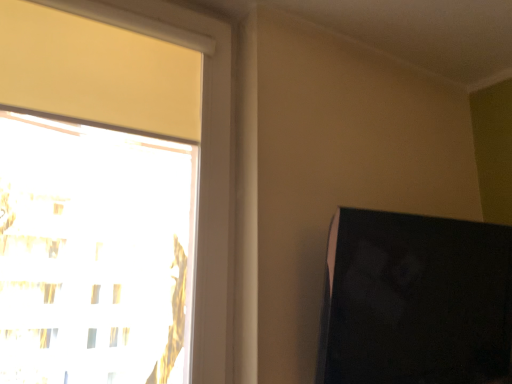
Question: Considering the positions of matte black monitor at right and transparent glass window at upper left in the image, is matte black monitor at right taller or shorter than transparent glass window at upper left?

Choices:
 (A) short
 (B) tall

Answer: (A)

Question: Is point tap(501, 243) positioned closer to the camera than point tap(14, 34)?

Choices:
 (A) farther
 (B) closer

Answer: (A)

Question: Considering the relative positions of matte black monitor at right and transparent glass window at upper left in the image provided, is matte black monitor at right to the left or to the right of transparent glass window at upper left?

Choices:
 (A) left
 (B) right

Answer: (B)

Question: Is transparent glass window at upper left bigger or smaller than matte black monitor at right?

Choices:
 (A) big
 (B) small

Answer: (B)

Question: From their relative heights in the image, would you say transparent glass window at upper left is taller or shorter than matte black monitor at right?

Choices:
 (A) tall
 (B) short

Answer: (A)

Question: Would you say transparent glass window at upper left is to the left or to the right of matte black monitor at right in the picture?

Choices:
 (A) right
 (B) left

Answer: (B)

Question: From the image's perspective, relative to matte black monitor at right, is transparent glass window at upper left above or below?

Choices:
 (A) below
 (B) above

Answer: (B)